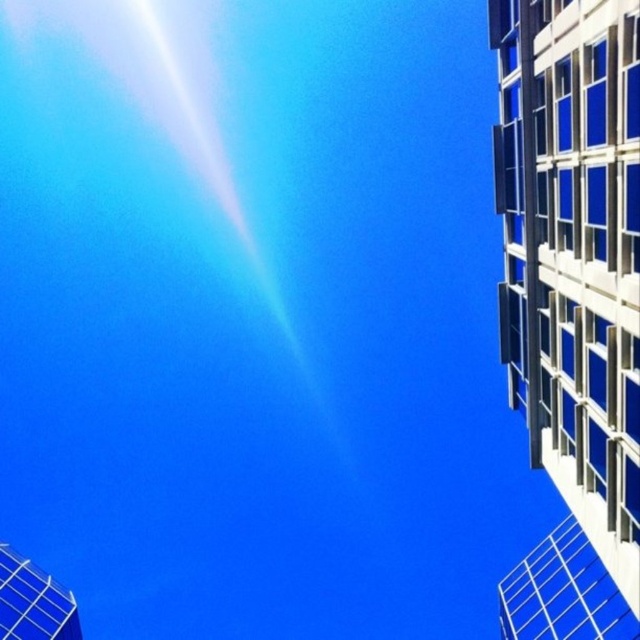
Question: Which point is closer to the camera?

Choices:
 (A) (497, 150)
 (B) (67, 600)

Answer: (A)

Question: Can you confirm if white glass building at right is bigger than metallic grid tower at bottom left?

Choices:
 (A) no
 (B) yes

Answer: (B)

Question: Is white glass building at right to the left of metallic grid tower at bottom left from the viewer's perspective?

Choices:
 (A) yes
 (B) no

Answer: (B)

Question: Which object appears farthest from the camera in this image?

Choices:
 (A) white glass building at right
 (B) metallic grid tower at bottom left

Answer: (B)

Question: Does white glass building at right have a larger size compared to metallic grid tower at bottom left?

Choices:
 (A) yes
 (B) no

Answer: (A)